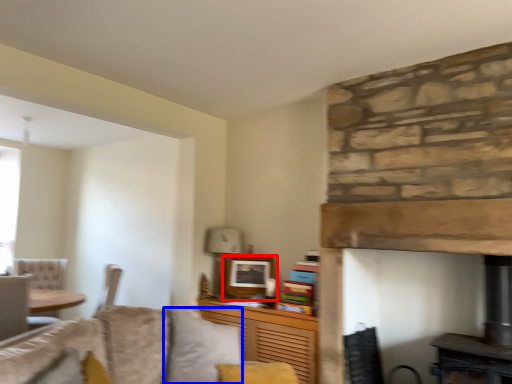
Question: Among these objects, which one is farthest to the camera, picture frame (highlighted by a red box) or pillow (highlighted by a blue box)?

Choices:
 (A) picture frame
 (B) pillow

Answer: (A)